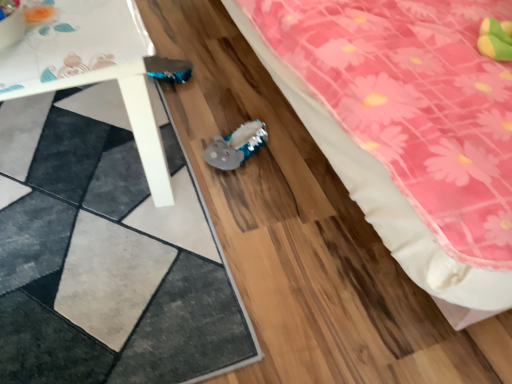
Based on the photo, what is the approximate width of fuzzy fabric plushie at center?

It is 8.45 inches.

Identify the location of fuzzy fabric plushie at center. (236, 146).

What is the approximate height of textured gray rug at lower left?

0.68 inches.

The image size is (512, 384). What are the coordinates of `white plastic table at lower left` in the screenshot? It's located at (93, 67).

In order to click on pink fabric bed at lower right in this screenshot , I will do `click(387, 203)`.

Is fuzzy fabric plushie at center taller or shorter than white plastic table at lower left?

Clearly, fuzzy fabric plushie at center is shorter compared to white plastic table at lower left.

Which object is positioned more to the left, fuzzy fabric plushie at center or white plastic table at lower left?

→ white plastic table at lower left is more to the left.

Would you say white plastic table at lower left is part of fuzzy fabric plushie at center's contents?

No.

Is there a large distance between fuzzy fabric plushie at center and white plastic table at lower left?

No.

Does point (154, 196) lie in front of point (236, 152)?

Yes.

From a real-world perspective, is white plastic table at lower left positioned under fuzzy fabric plushie at center based on gravity?

No, from a real-world perspective, white plastic table at lower left is not under fuzzy fabric plushie at center.

In the scene shown: How many degrees apart are the facing directions of white plastic table at lower left and fuzzy fabric plushie at center?

The facing directions of white plastic table at lower left and fuzzy fabric plushie at center are 89.5 degrees apart.

Is pink fabric bed at lower right to the left of fuzzy fabric plushie at center from the viewer's perspective?

In fact, pink fabric bed at lower right is to the right of fuzzy fabric plushie at center.

You are a GUI agent. You are given a task and a screenshot of the screen. Output one action in this format:
    pyautogui.click(x=<x>, y=<y>)
    Task: Click on the bed above the fuzzy fabric plushie at center (from the image's perspective)
    Image resolution: width=512 pixels, height=384 pixels.
    Given the screenshot: What is the action you would take?
    pyautogui.click(x=387, y=203)

Which is behind, point (465, 293) or point (231, 165)?

The point (231, 165) is farther from the camera.

Is pink fabric bed at lower right shorter than fuzzy fabric plushie at center?

No.

From the image's perspective, relative to pink fabric bed at lower right, is white plastic table at lower left above or below?

Based on their image positions, white plastic table at lower left is located beneath pink fabric bed at lower right.

Looking at this image, relative to pink fabric bed at lower right, is white plastic table at lower left in front or behind?

In the image, white plastic table at lower left appears behind pink fabric bed at lower right.

Based on the photo, which point is more distant from viewer, (77, 49) or (372, 175)?

The point (77, 49) is farther.

Are white plastic table at lower left and pink fabric bed at lower right beside each other?

No, white plastic table at lower left is not making contact with pink fabric bed at lower right.

What's the angular difference between textured gray rug at lower left and white plastic table at lower left's facing directions?

0.487 degrees separate the facing orientations of textured gray rug at lower left and white plastic table at lower left.

Is textured gray rug at lower left turned away from white plastic table at lower left?

That's not correct — textured gray rug at lower left is not looking away from white plastic table at lower left.

Which is more to the right, textured gray rug at lower left or white plastic table at lower left?

textured gray rug at lower left is more to the right.

How distant is textured gray rug at lower left from white plastic table at lower left?

textured gray rug at lower left is 13.39 inches from white plastic table at lower left.

Between fuzzy fabric plushie at center and textured gray rug at lower left, which one has larger size?

Bigger between the two is textured gray rug at lower left.

Does fuzzy fabric plushie at center have a greater width compared to textured gray rug at lower left?

Incorrect, the width of fuzzy fabric plushie at center does not surpass that of textured gray rug at lower left.

Is fuzzy fabric plushie at center touching textured gray rug at lower left?

fuzzy fabric plushie at center and textured gray rug at lower left are not in contact.

Does textured gray rug at lower left have a larger size compared to fuzzy fabric plushie at center?

Yes, textured gray rug at lower left is bigger than fuzzy fabric plushie at center.

Which is farther from the camera, (x=143, y=304) or (x=256, y=134)?

Point (x=256, y=134)

From the picture: From a real-world perspective, which is physically below, textured gray rug at lower left or fuzzy fabric plushie at center?

textured gray rug at lower left, from a real-world perspective.

Find the location of a particular element. table located above the fuzzy fabric plushie at center (from the image's perspective) is located at coordinates (93, 67).

The image size is (512, 384). In order to click on table lying in front of the fuzzy fabric plushie at center in this screenshot , I will do `click(93, 67)`.

Considering their positions, is fuzzy fabric plushie at center positioned further to white plastic table at lower left than textured gray rug at lower left?

fuzzy fabric plushie at center is further to white plastic table at lower left.

Which object lies further to the anchor point fuzzy fabric plushie at center, pink fabric bed at lower right or white plastic table at lower left?

pink fabric bed at lower right.

Considering their positions, is fuzzy fabric plushie at center positioned closer to textured gray rug at lower left than white plastic table at lower left?

white plastic table at lower left.

From the image, which object appears to be nearer to textured gray rug at lower left, fuzzy fabric plushie at center or pink fabric bed at lower right?

fuzzy fabric plushie at center is closer to textured gray rug at lower left.

Considering their positions, is white plastic table at lower left positioned closer to fuzzy fabric plushie at center than pink fabric bed at lower right?

Based on the image, white plastic table at lower left appears to be nearer to fuzzy fabric plushie at center.

Based on their spatial positions, is fuzzy fabric plushie at center or pink fabric bed at lower right closer to white plastic table at lower left?

Among the two, fuzzy fabric plushie at center is located nearer to white plastic table at lower left.

From the image, which object appears to be farther from textured gray rug at lower left, white plastic table at lower left or fuzzy fabric plushie at center?

fuzzy fabric plushie at center is further to textured gray rug at lower left.

Based on their spatial positions, is white plastic table at lower left or textured gray rug at lower left further from fuzzy fabric plushie at center?

The object further to fuzzy fabric plushie at center is white plastic table at lower left.

Where is `square located between pink fabric bed at lower right and fuzzy fabric plushie at center in the depth direction`? This screenshot has height=384, width=512. square located between pink fabric bed at lower right and fuzzy fabric plushie at center in the depth direction is located at coordinates (105, 253).

Identify the location of stuff between white plastic table at lower left and pink fabric bed at lower right in the horizontal direction. (236, 146).

I want to click on square positioned between white plastic table at lower left and fuzzy fabric plushie at center from near to far, so click(x=105, y=253).

Image resolution: width=512 pixels, height=384 pixels. What are the coordinates of `square between white plastic table at lower left and pink fabric bed at lower right from left to right` in the screenshot? It's located at pyautogui.click(x=105, y=253).